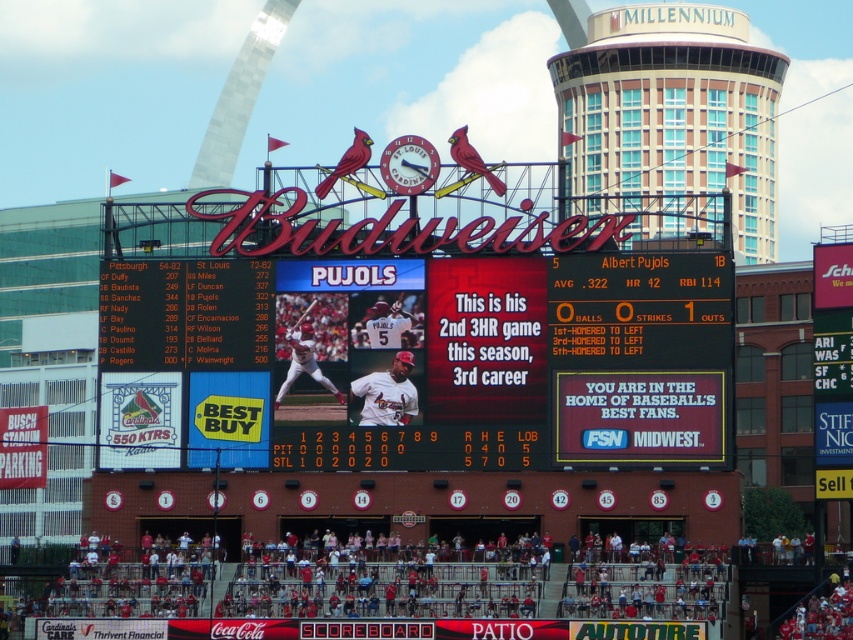
Can you confirm if matte black scoreboard at center is positioned below white jersey baseball player at center?

No.

Is matte black scoreboard at center further to camera compared to white jersey baseball player at center?

Yes, it is behind white jersey baseball player at center.

Image resolution: width=853 pixels, height=640 pixels. What do you see at coordinates (555, 369) in the screenshot?
I see `matte black scoreboard at center` at bounding box center [555, 369].

Identify the location of matte black scoreboard at center. (555, 369).